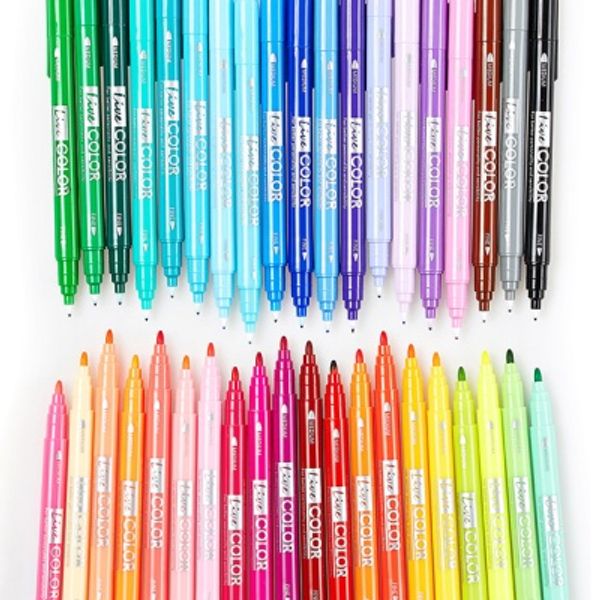
Identify the location of pens with a green hue. (85, 191), (115, 189), (67, 189), (549, 465), (521, 476), (465, 487).